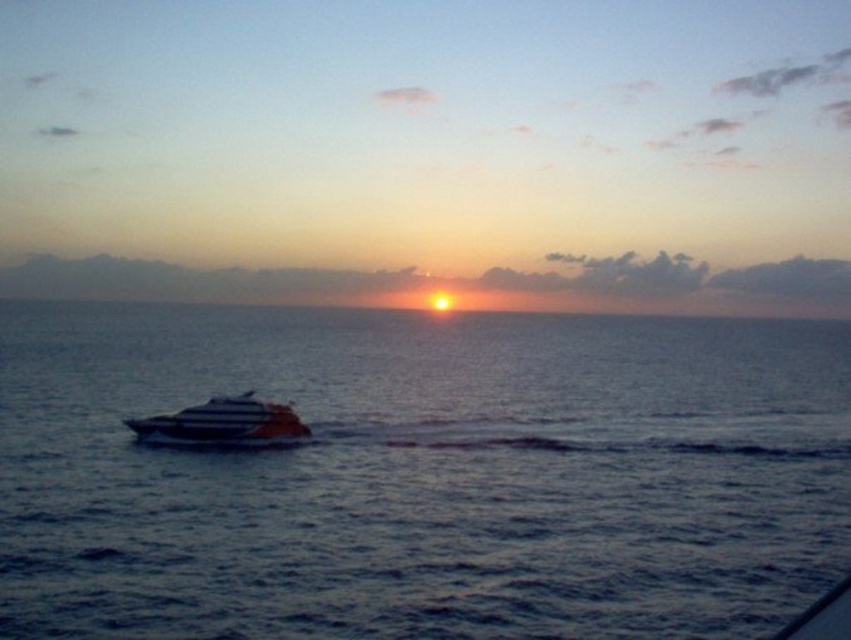
You are a photographer standing on the shore and want to capture both the blue water at center and the white glossy boat at center in your shot. Based on their sizes in the image, which one would appear larger in the photo?

The blue water at center appears larger in the photo because it is much taller than the white glossy boat at center according to the description.

You are an observer standing on the shore looking at the blue water at center and the white glossy boat at center. Which object takes up more space in the image?

The blue water at center takes up more space in the image because it is larger in size than the white glossy boat at center.

You are standing on the shore looking out at the seascape. There is a point marked at coordinates (421, 476). What is located at that point?

The point at coordinates (421, 476) corresponds to blue water at center.